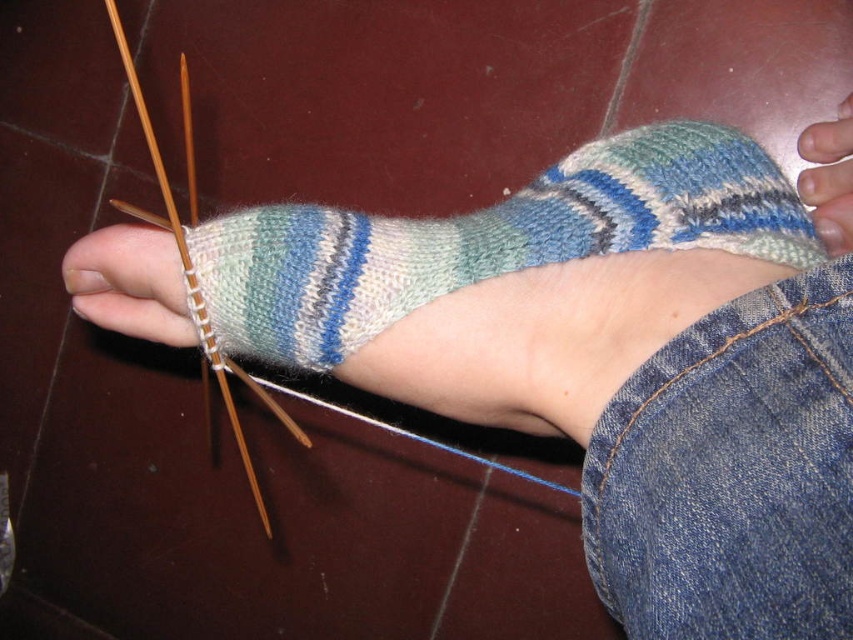
Question: Does knitted woolen sock at center have a lesser width compared to wooden knitting needle at lower left?

Choices:
 (A) no
 (B) yes

Answer: (A)

Question: Which of these objects is positioned farthest from the wooden knitting needle at lower left?

Choices:
 (A) knitted woolen sock at center
 (B) smooth skin at center

Answer: (B)

Question: Which point is closer to the camera?

Choices:
 (A) smooth skin at center
 (B) knitted woolen sock at center
 (C) wooden knitting needle at lower left

Answer: (B)

Question: Which point is closer to the camera?

Choices:
 (A) (809, 148)
 (B) (293, 422)
 (C) (293, 310)

Answer: (C)

Question: Does wooden knitting needle at lower left appear over smooth skin at center?

Choices:
 (A) yes
 (B) no

Answer: (B)

Question: Does knitted woolen sock at center have a smaller size compared to smooth skin at center?

Choices:
 (A) no
 (B) yes

Answer: (A)